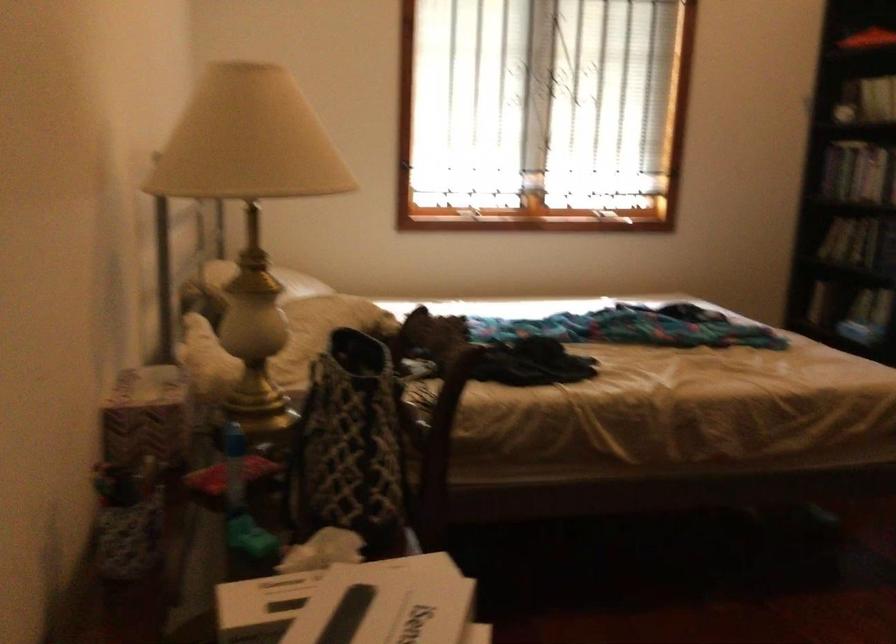
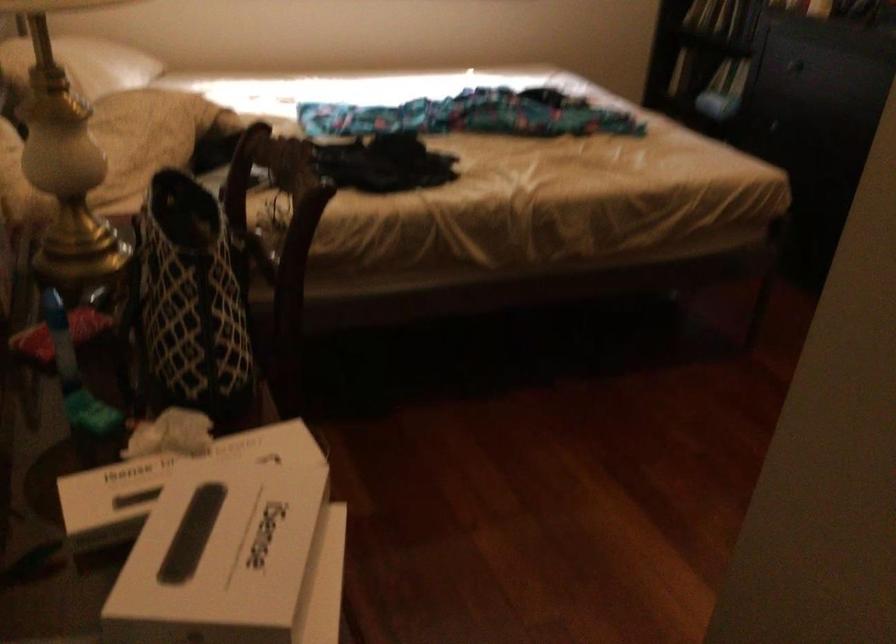
In the second image, find the point that corresponds to point (351, 426) in the first image.

(188, 301)